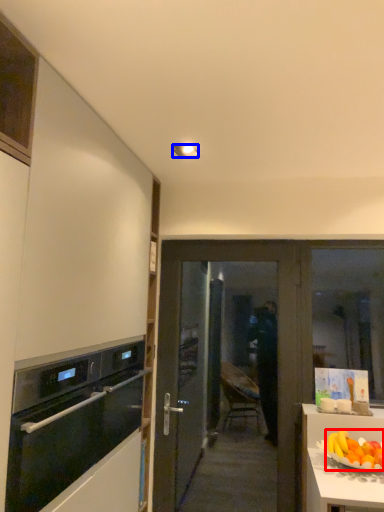
Question: Which object is closer to the camera taking this photo, grapefruit (highlighted by a red box) or lamp (highlighted by a blue box)?

Choices:
 (A) grapefruit
 (B) lamp

Answer: (A)